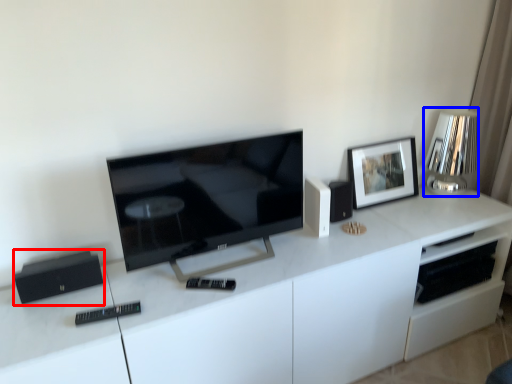
Question: Among these objects, which one is nearest to the camera, appliance (highlighted by a red box) or lamp (highlighted by a blue box)?

Choices:
 (A) appliance
 (B) lamp

Answer: (A)